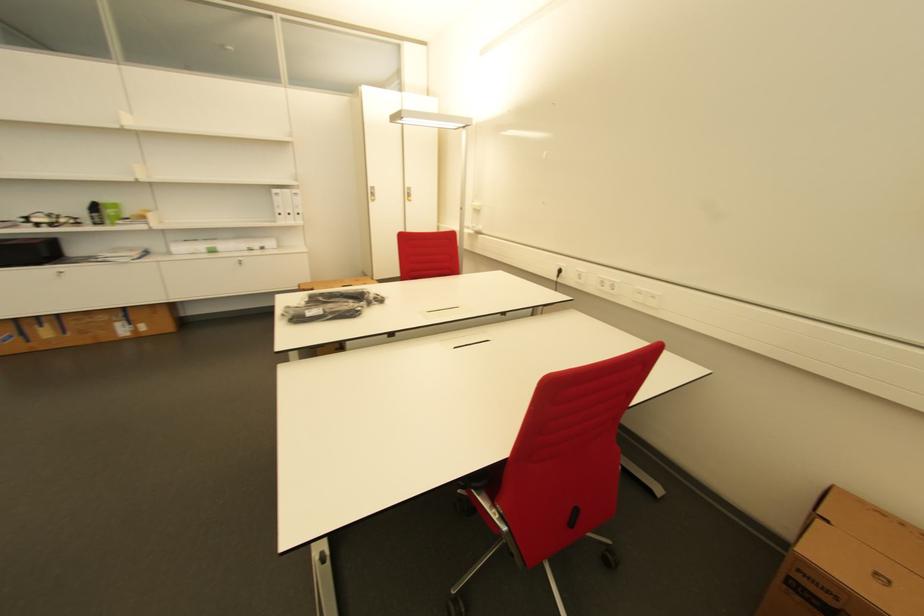
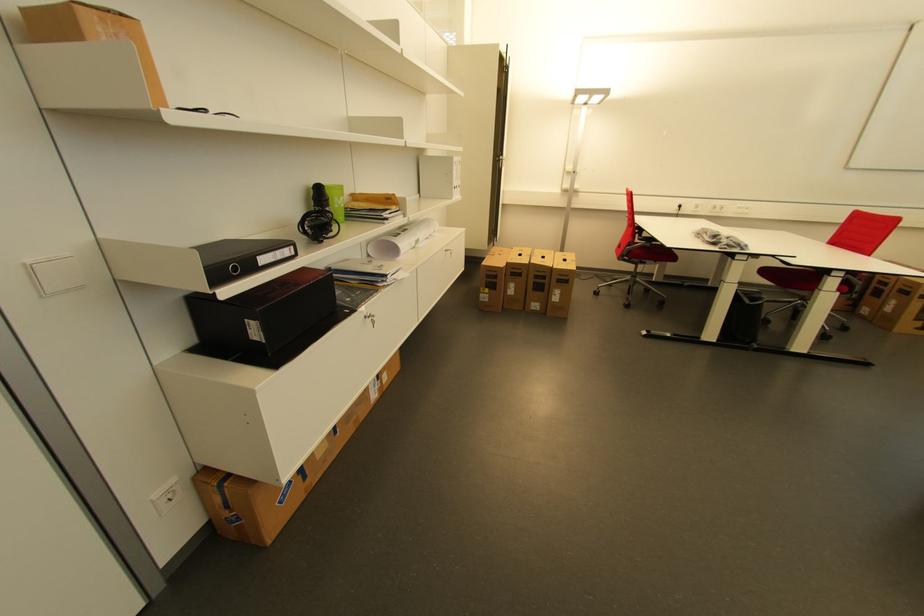
In the second image, find the point that corresponds to (104,208) in the first image.

(333, 193)